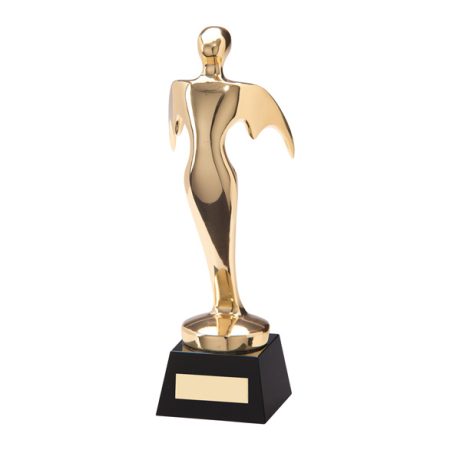
The width and height of the screenshot is (450, 450). I want to click on chest, so click(x=205, y=102).